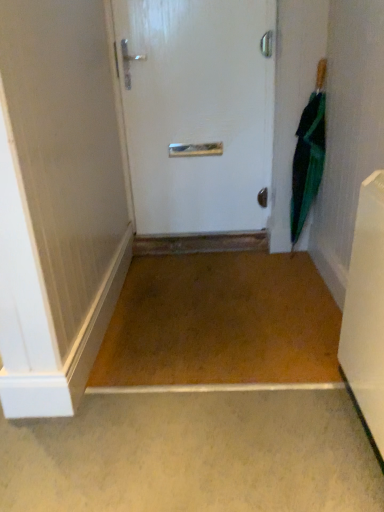
Question: Can you confirm if white plastic radiator at lower right is wider than green matte umbrella at right?

Choices:
 (A) no
 (B) yes

Answer: (B)

Question: Is white plastic radiator at lower right not close to green matte umbrella at right?

Choices:
 (A) yes
 (B) no

Answer: (A)

Question: From a real-world perspective, is white plastic radiator at lower right located beneath green matte umbrella at right?

Choices:
 (A) no
 (B) yes

Answer: (B)

Question: Can you confirm if white plastic radiator at lower right is positioned to the right of green matte umbrella at right?

Choices:
 (A) no
 (B) yes

Answer: (A)

Question: Does white plastic radiator at lower right have a lesser width compared to green matte umbrella at right?

Choices:
 (A) no
 (B) yes

Answer: (A)

Question: From their relative heights in the image, would you say green matte umbrella at right is taller or shorter than white plastic radiator at lower right?

Choices:
 (A) short
 (B) tall

Answer: (B)

Question: From the image's perspective, is green matte umbrella at right above or below white plastic radiator at lower right?

Choices:
 (A) below
 (B) above

Answer: (B)

Question: In the image, is green matte umbrella at right on the left side or the right side of white plastic radiator at lower right?

Choices:
 (A) right
 (B) left

Answer: (A)

Question: Is green matte umbrella at right in front of or behind white plastic radiator at lower right in the image?

Choices:
 (A) front
 (B) behind

Answer: (B)

Question: From the image's perspective, relative to white glossy door at center, is green matte umbrella at right above or below?

Choices:
 (A) above
 (B) below

Answer: (B)

Question: In terms of height, does green matte umbrella at right look taller or shorter compared to white glossy door at center?

Choices:
 (A) short
 (B) tall

Answer: (A)

Question: Is green matte umbrella at right inside or outside of white glossy door at center?

Choices:
 (A) inside
 (B) outside

Answer: (B)

Question: Based on their sizes in the image, would you say green matte umbrella at right is bigger or smaller than white glossy door at center?

Choices:
 (A) small
 (B) big

Answer: (A)

Question: From a real-world perspective, is white plastic radiator at lower right positioned above or below white glossy door at center?

Choices:
 (A) above
 (B) below

Answer: (B)

Question: From the image's perspective, is white plastic radiator at lower right above or below white glossy door at center?

Choices:
 (A) above
 (B) below

Answer: (B)